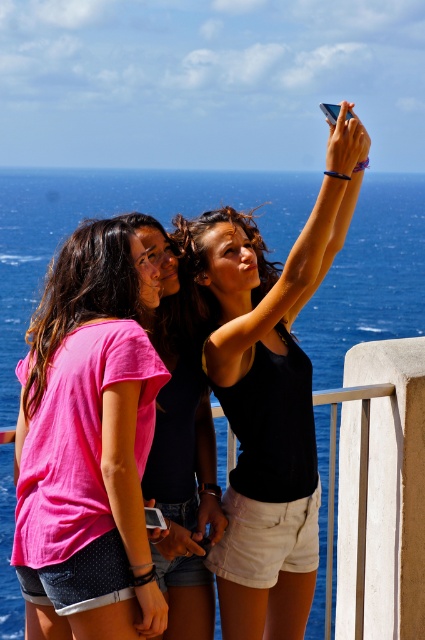
Can you confirm if black matte tank top at upper center is positioned to the right of pink cotton shirt at center?

Yes, black matte tank top at upper center is to the right of pink cotton shirt at center.

What do you see at coordinates (268, 392) in the screenshot? I see `black matte tank top at upper center` at bounding box center [268, 392].

Find the location of `black matte tank top at upper center`. black matte tank top at upper center is located at coordinates click(268, 392).

Is pink cotton t-shirt at center above pink cotton shirt at center?

Yes, pink cotton t-shirt at center is above pink cotton shirt at center.

Which is more to the left, pink cotton t-shirt at center or pink cotton shirt at center?

pink cotton t-shirt at center

The height and width of the screenshot is (640, 425). Describe the element at coordinates (91, 424) in the screenshot. I see `pink cotton t-shirt at center` at that location.

You are a GUI agent. You are given a task and a screenshot of the screen. Output one action in this format:
    pyautogui.click(x=<x>, y=<y>)
    Task: Click on the pink cotton t-shirt at center
    This screenshot has height=640, width=425.
    Given the screenshot: What is the action you would take?
    pyautogui.click(x=91, y=424)

Between black matte tank top at upper center and pink cotton t-shirt at center, which one has more height?

Standing taller between the two is black matte tank top at upper center.

Where is `black matte tank top at upper center`? black matte tank top at upper center is located at coordinates point(268,392).

Identify the location of black matte tank top at upper center. This screenshot has height=640, width=425. (268, 392).